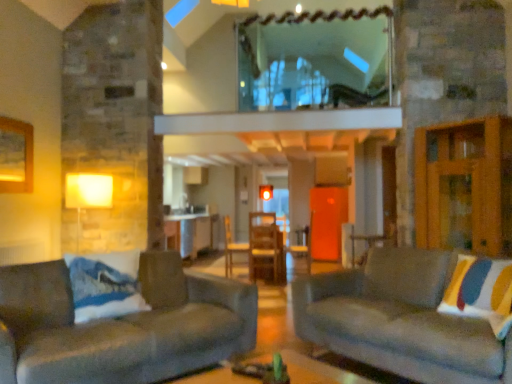
Where is `clear glass window at upper center`? clear glass window at upper center is located at coordinates (315, 60).

At what (x,y) coordinates should I click in order to perform the action: click on velvet gray couch at right, the 1th studio couch viewed from the right. Please return your answer as a coordinate pair (x, y). Looking at the image, I should click on (400, 320).

Locate an element on the screen. This screenshot has height=384, width=512. striped fabric pillow at right is located at coordinates (481, 292).

Locate an element on the screen. clear glass window at upper center is located at coordinates (315, 60).

Is wooden chair at center positioned far away from metallic silver table at center?

wooden chair at center is actually quite close to metallic silver table at center.

Does wooden chair at center contain metallic silver table at center?

No, metallic silver table at center is not a part of wooden chair at center.

Which object is positioned more to the right, wooden chair at center or metallic silver table at center?

wooden chair at center.

Looking at this image, between wooden chair at center and metallic silver table at center, which one has smaller size?

Smaller between the two is wooden chair at center.

Who is more distant, striped fabric pillow at right or clear glass window at upper center?

Positioned behind is clear glass window at upper center.

Does striped fabric pillow at right have a smaller size compared to clear glass window at upper center?

Yes.

Which object is wider, striped fabric pillow at right or clear glass window at upper center?

striped fabric pillow at right.

Considering the sizes of wooden chair at center and matte yellow lampshade at left in the image, is wooden chair at center wider or thinner than matte yellow lampshade at left?

Considering their sizes, wooden chair at center looks slimmer than matte yellow lampshade at left.

Which object is positioned more to the right, wooden chair at center or matte yellow lampshade at left?

wooden chair at center is more to the right.

Measure the distance between wooden chair at center and matte yellow lampshade at left.

wooden chair at center and matte yellow lampshade at left are 3.86 meters apart.

Would you consider wooden chair at center to be distant from matte yellow lampshade at left?

Yes.

Who is taller, velvet gray couch at left, positioned as the first studio couch in left-to-right order, or striped fabric pillow at right?

velvet gray couch at left, positioned as the first studio couch in left-to-right order, is taller.

Consider the image. Is velvet gray couch at left, acting as the 2th studio couch starting from the right, further to camera compared to striped fabric pillow at right?

No, it is not.

Would you say striped fabric pillow at right is part of velvet gray couch at left, positioned as the first studio couch in left-to-right order,'s contents?

No, striped fabric pillow at right is located outside of velvet gray couch at left, positioned as the first studio couch in left-to-right order.

Is velvet gray couch at left, acting as the 2th studio couch starting from the right, oriented towards striped fabric pillow at right?

No.

Do you think matte yellow lampshade at left is within clear glass window at upper center, or outside of it?

matte yellow lampshade at left is not inside clear glass window at upper center, it's outside.

Considering the sizes of matte yellow lampshade at left and clear glass window at upper center in the image, is matte yellow lampshade at left wider or thinner than clear glass window at upper center?

matte yellow lampshade at left is wider than clear glass window at upper center.

Looking at the image, does matte yellow lampshade at left seem bigger or smaller compared to clear glass window at upper center?

matte yellow lampshade at left is bigger than clear glass window at upper center.

The image size is (512, 384). I want to click on lamp below the clear glass window at upper center (from a real-world perspective), so click(x=87, y=194).

Is velvet gray couch at right, the 1th studio couch viewed from the right, completely or partially outside of striped fabric pillow at right?

Yes.

Who is smaller, velvet gray couch at right, placed as the 2th studio couch when sorted from left to right, or striped fabric pillow at right?

Smaller between the two is striped fabric pillow at right.

From a real-world perspective, is velvet gray couch at right, placed as the 2th studio couch when sorted from left to right, on top of striped fabric pillow at right?

No, from a real-world perspective, velvet gray couch at right, placed as the 2th studio couch when sorted from left to right, is not on top of striped fabric pillow at right.

Which object is further away from the camera, velvet gray couch at right, the 1th studio couch viewed from the right, or striped fabric pillow at right?

striped fabric pillow at right is more distant.

Is velvet gray couch at left, positioned as the first studio couch in left-to-right order, further to camera compared to metallic silver table at center?

No, velvet gray couch at left, positioned as the first studio couch in left-to-right order, is closer to the camera.

In terms of size, does velvet gray couch at left, acting as the 2th studio couch starting from the right, appear bigger or smaller than metallic silver table at center?

Clearly, velvet gray couch at left, acting as the 2th studio couch starting from the right, is larger in size than metallic silver table at center.

Is there a large distance between velvet gray couch at left, positioned as the first studio couch in left-to-right order, and metallic silver table at center?

Yes, velvet gray couch at left, positioned as the first studio couch in left-to-right order, is far from metallic silver table at center.

From the picture: Can you confirm if velvet gray couch at left, positioned as the first studio couch in left-to-right order, is thinner than metallic silver table at center?

Incorrect, the width of velvet gray couch at left, positioned as the first studio couch in left-to-right order, is not less than that of metallic silver table at center.

Identify the location of table that appears on the left of wooden chair at center. (189, 232).

Image resolution: width=512 pixels, height=384 pixels. In order to click on pillow below the clear glass window at upper center (from a real-world perspective) in this screenshot , I will do tap(481, 292).

Which object lies nearer to the anchor point matte yellow lampshade at left, velvet gray couch at right, the 1th studio couch viewed from the right, or velvet gray couch at left, acting as the 2th studio couch starting from the right?

velvet gray couch at left, acting as the 2th studio couch starting from the right, is positioned closer to the anchor matte yellow lampshade at left.

From the image, which object appears to be nearer to velvet gray couch at right, placed as the 2th studio couch when sorted from left to right, velvet gray couch at left, positioned as the first studio couch in left-to-right order, or striped fabric pillow at right?

striped fabric pillow at right lies closer to velvet gray couch at right, placed as the 2th studio couch when sorted from left to right, than the other object.

When comparing their distances from clear glass window at upper center, does velvet gray couch at left, positioned as the first studio couch in left-to-right order, or matte yellow lampshade at left seem closer?

Based on the image, matte yellow lampshade at left appears to be nearer to clear glass window at upper center.

When comparing their distances from metallic silver table at center, does matte yellow lampshade at left or clear glass window at upper center seem closer?

matte yellow lampshade at left.

Looking at the image, which one is located further to metallic silver table at center, striped fabric pillow at right or matte yellow lampshade at left?

striped fabric pillow at right lies further to metallic silver table at center than the other object.

Based on their spatial positions, is matte yellow lampshade at left or velvet gray couch at left, acting as the 2th studio couch starting from the right, closer to wooden chair at center?

matte yellow lampshade at left is positioned closer to the anchor wooden chair at center.

Considering their positions, is matte yellow lampshade at left positioned closer to clear glass window at upper center than wooden chair at center?

The object closer to clear glass window at upper center is matte yellow lampshade at left.

Which object lies nearer to the anchor point velvet gray couch at right, placed as the 2th studio couch when sorted from left to right, wooden chair at center or clear glass window at upper center?

clear glass window at upper center lies closer to velvet gray couch at right, placed as the 2th studio couch when sorted from left to right, than the other object.

The width and height of the screenshot is (512, 384). I want to click on armchair situated between matte yellow lampshade at left and clear glass window at upper center from left to right, so click(x=231, y=247).

In order to click on pillow located between velvet gray couch at left, acting as the 2th studio couch starting from the right, and metallic silver table at center in the depth direction in this screenshot , I will do `click(481, 292)`.

This screenshot has width=512, height=384. What are the coordinates of `studio couch situated between matte yellow lampshade at left and velvet gray couch at right, the 1th studio couch viewed from the right, from left to right` in the screenshot? It's located at pos(121,326).

I want to click on window between velvet gray couch at left, acting as the 2th studio couch starting from the right, and wooden chair at center in the front-back direction, so click(315, 60).